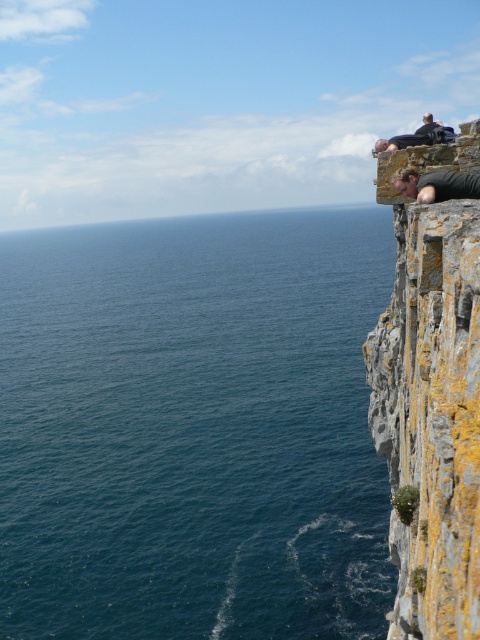
Question: Which of these objects is positioned farthest from the yellow mossy rock at upper right?

Choices:
 (A) blue water at left
 (B) matte black jacket at upper right
 (C) dark gray stone climber at upper right

Answer: (A)

Question: From the image, what is the correct spatial relationship of yellow mossy rock at upper right in relation to matte black jacket at upper right?

Choices:
 (A) right
 (B) left

Answer: (B)

Question: Does blue water at left have a larger size compared to yellow mossy rock at upper right?

Choices:
 (A) yes
 (B) no

Answer: (A)

Question: Which object appears farthest from the camera in this image?

Choices:
 (A) dark gray stone climber at upper right
 (B) blue water at left
 (C) yellow mossy rock at upper right
 (D) matte black jacket at upper right

Answer: (B)

Question: Does blue water at left appear under matte black jacket at upper right?

Choices:
 (A) no
 (B) yes

Answer: (B)

Question: Which point is farther from the camera taking this photo?

Choices:
 (A) (412, 134)
 (B) (455, 204)
 (C) (96, 445)

Answer: (C)